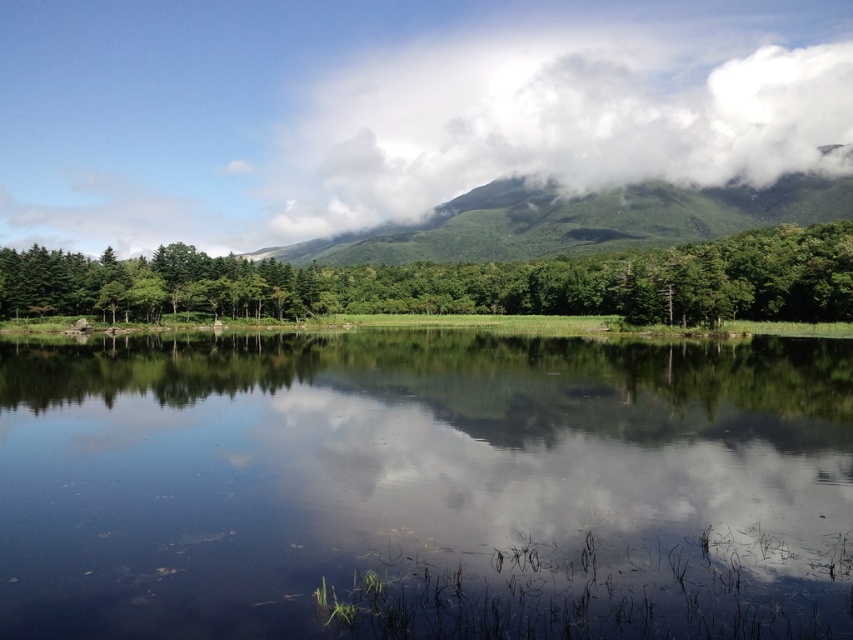
Based on the scene description, where is the white fluffy cloud at upper center located in relation to the point marked at coordinates (563, 108)?

The point marked at coordinates (563, 108) indicates the location of the white fluffy cloud at upper center.

You are standing at the edge of the lake and looking towards the center. Which object, the transparent water at center or the green leafy tree at center, appears taller from your viewpoint?

The green leafy tree at center appears taller than the transparent water at center because the transparent water at center has a lesser height compared to green leafy tree at center.

You are standing at the edge of the lake and see the transparent water at center and the green leafy tree at center. Which object is closer to you?

The transparent water at center is closer to you because it is in front of the green leafy tree at center.